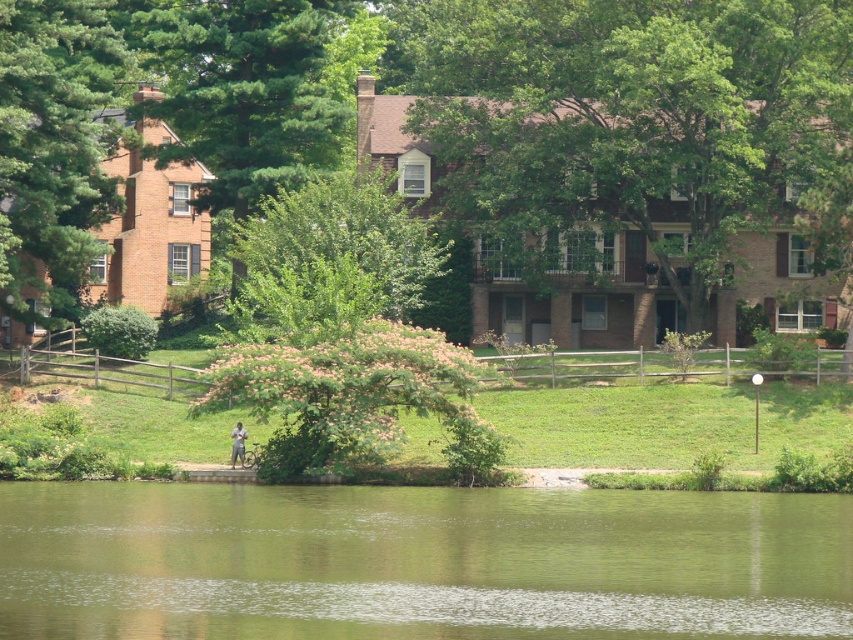
Does green leafy tree at upper center have a lesser width compared to green leafy tree at center?

Incorrect, green leafy tree at upper center's width is not less than green leafy tree at center's.

Between green leafy tree at upper center and green leafy tree at center, which one is positioned lower?

Positioned lower is green leafy tree at center.

Which is in front, point (781, 40) or point (332, 253)?

Positioned in front is point (332, 253).

Where is `green leafy tree at upper center`? The height and width of the screenshot is (640, 853). green leafy tree at upper center is located at coordinates (630, 118).

Who is lower down, green liquid water at lower center or light brown fabric shirt at lower center?

Positioned lower is green liquid water at lower center.

What do you see at coordinates (418, 563) in the screenshot? This screenshot has height=640, width=853. I see `green liquid water at lower center` at bounding box center [418, 563].

You are a GUI agent. You are given a task and a screenshot of the screen. Output one action in this format:
    pyautogui.click(x=<x>, y=<y>)
    Task: Click on the green liquid water at lower center
    Image resolution: width=853 pixels, height=640 pixels.
    Given the screenshot: What is the action you would take?
    pyautogui.click(x=418, y=563)

Can you confirm if green liquid water at lower center is bigger than pink fluffy tree at center?

Indeed, green liquid water at lower center has a larger size compared to pink fluffy tree at center.

Between green liquid water at lower center and pink fluffy tree at center, which one appears on the left side from the viewer's perspective?

From the viewer's perspective, pink fluffy tree at center appears more on the left side.

This screenshot has height=640, width=853. Describe the element at coordinates (418, 563) in the screenshot. I see `green liquid water at lower center` at that location.

This screenshot has width=853, height=640. Find the location of `green liquid water at lower center`. green liquid water at lower center is located at coordinates (418, 563).